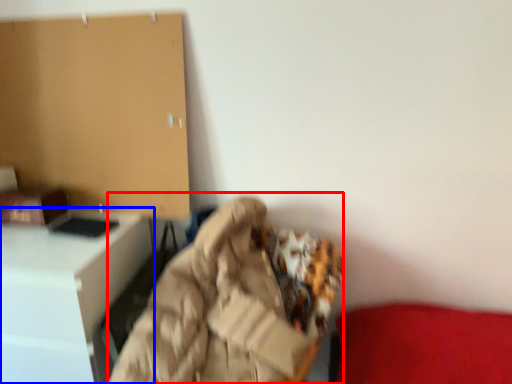
Question: Which object is closer to the camera taking this photo, bean bag chair (highlighted by a red box) or furniture (highlighted by a blue box)?

Choices:
 (A) bean bag chair
 (B) furniture

Answer: (A)